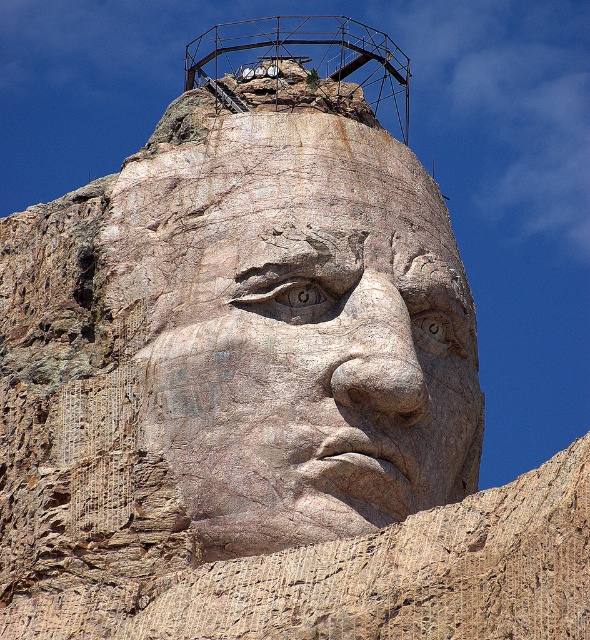
Question: Does carved stone face at center have a larger size compared to rusty metal water tower at upper center?

Choices:
 (A) no
 (B) yes

Answer: (A)

Question: Is carved stone face at center bigger than rusty metal water tower at upper center?

Choices:
 (A) yes
 (B) no

Answer: (B)

Question: Which point appears farthest from the camera in this image?

Choices:
 (A) (254, 58)
 (B) (124, 264)

Answer: (A)

Question: Does carved stone face at center have a greater width compared to rusty metal water tower at upper center?

Choices:
 (A) yes
 (B) no

Answer: (B)

Question: Which point appears farthest from the camera in this image?

Choices:
 (A) (293, 304)
 (B) (381, 92)

Answer: (B)